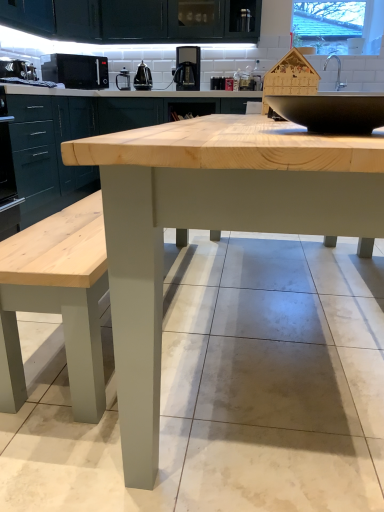
This screenshot has width=384, height=512. Identify the location of vacant space underneath natural wood table at center (from a real-world perspective). (278, 314).